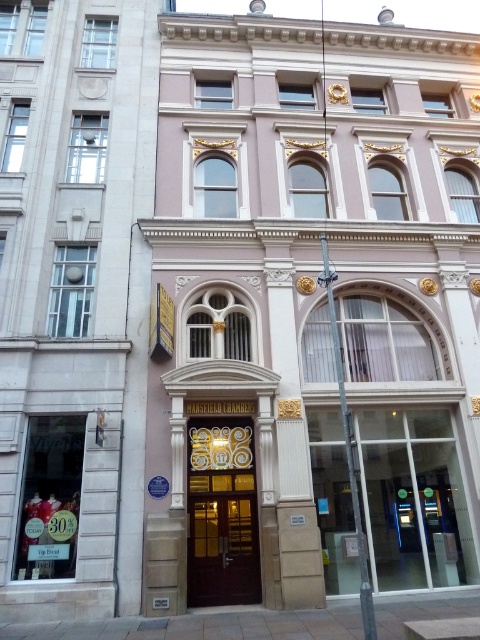
You are a painter who wants to paint the matte stone building at center and the gold ornate door at center. Since you need to set up your easel, which object should you place your easel closer to if you want to paint both with equal detail?

The matte stone building at center is taller than the gold ornate door at center. To paint both with equal detail, you should place your easel closer to the matte stone building at center because it is taller and requires more focus from a closer distance.

You are standing in front of the building and want to touch both the matte stone building at center and the gold ornate door at center. Which one can you reach first without moving your position?

The matte stone building at center is closer to the viewer than the gold ornate door at center, so you can reach it first without moving.